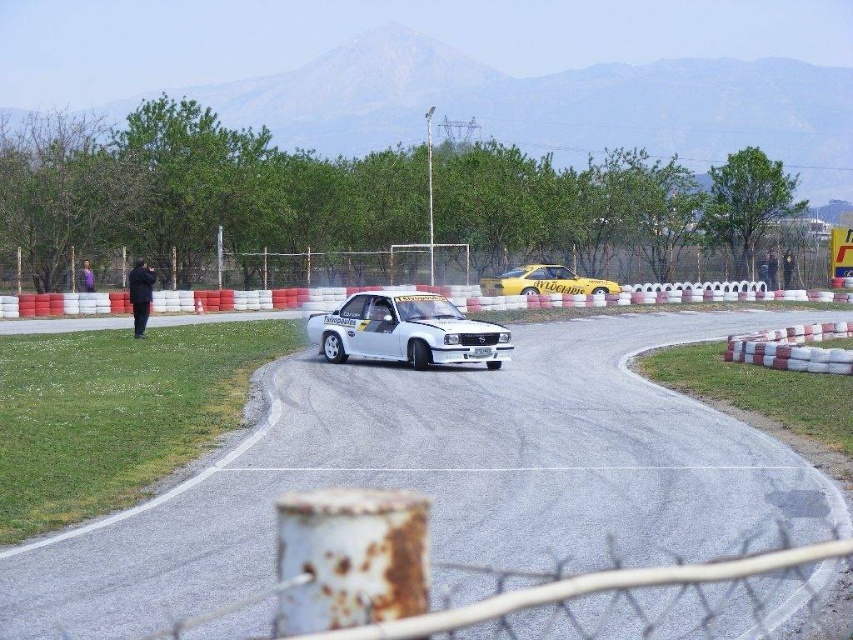
Question: Estimate the real-world distances between objects in this image. Which object is closer to the white glossy car at center?

Choices:
 (A) yellow matte car at center
 (B) white asphalt race track at center

Answer: (B)

Question: Does white glossy car at center appear on the left side of yellow matte car at center?

Choices:
 (A) no
 (B) yes

Answer: (B)

Question: Can you confirm if white glossy car at center is positioned to the left of yellow matte car at center?

Choices:
 (A) no
 (B) yes

Answer: (B)

Question: Which object is the closest to the yellow matte car at center?

Choices:
 (A) white glossy car at center
 (B) white asphalt race track at center

Answer: (A)

Question: Based on their relative distances, which object is nearer to the yellow matte car at center?

Choices:
 (A) white asphalt race track at center
 (B) white glossy car at center

Answer: (B)

Question: Observing the image, what is the correct spatial positioning of white asphalt race track at center in reference to white glossy car at center?

Choices:
 (A) right
 (B) left

Answer: (B)